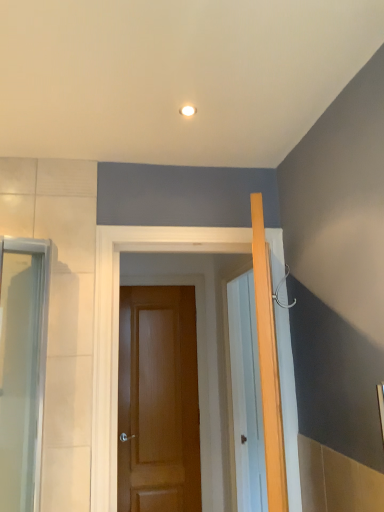
Question: Is clear glass screen door at left placed right next to glossy wood door at center, marked as the second door in a front-to-back arrangement?

Choices:
 (A) yes
 (B) no

Answer: (B)

Question: Considering the relative sizes of clear glass screen door at left and glossy wood door at center, marked as the second door in a front-to-back arrangement, in the image provided, is clear glass screen door at left thinner than glossy wood door at center, marked as the second door in a front-to-back arrangement,?

Choices:
 (A) no
 (B) yes

Answer: (A)

Question: Is clear glass screen door at left aimed at glossy wood door at center, positioned as the 1th door in back-to-front order?

Choices:
 (A) yes
 (B) no

Answer: (B)

Question: Is clear glass screen door at left surrounding glossy wood door at center, positioned as the 1th door in back-to-front order?

Choices:
 (A) no
 (B) yes

Answer: (A)

Question: Does clear glass screen door at left have a lesser height compared to glossy wood door at center, positioned as the 1th door in back-to-front order?

Choices:
 (A) no
 (B) yes

Answer: (B)

Question: Can you confirm if clear glass screen door at left is wider than glossy wood door at center, marked as the second door in a front-to-back arrangement?

Choices:
 (A) no
 (B) yes

Answer: (B)

Question: Could you tell me if glossy wood door at center, positioned as the 1th door in back-to-front order, is turned towards clear glass screen door at left?

Choices:
 (A) no
 (B) yes

Answer: (A)

Question: From the image's perspective, is glossy wood door at center, marked as the second door in a front-to-back arrangement, below clear glass screen door at left?

Choices:
 (A) no
 (B) yes

Answer: (B)

Question: Is glossy wood door at center, marked as the second door in a front-to-back arrangement, located outside clear glass screen door at left?

Choices:
 (A) no
 (B) yes

Answer: (B)

Question: Is clear glass screen door at left at the back of glossy wood door at center, marked as the second door in a front-to-back arrangement?

Choices:
 (A) yes
 (B) no

Answer: (B)

Question: Can you confirm if glossy wood door at center, marked as the second door in a front-to-back arrangement, is taller than clear glass screen door at left?

Choices:
 (A) yes
 (B) no

Answer: (A)

Question: Is glossy wood door at center, positioned as the 1th door in back-to-front order, next to clear glass screen door at left?

Choices:
 (A) no
 (B) yes

Answer: (A)

Question: Can you confirm if brown wooden door at center, which appears as the second door when viewed from the back, is bigger than glossy wood door at center, positioned as the 1th door in back-to-front order?

Choices:
 (A) yes
 (B) no

Answer: (A)